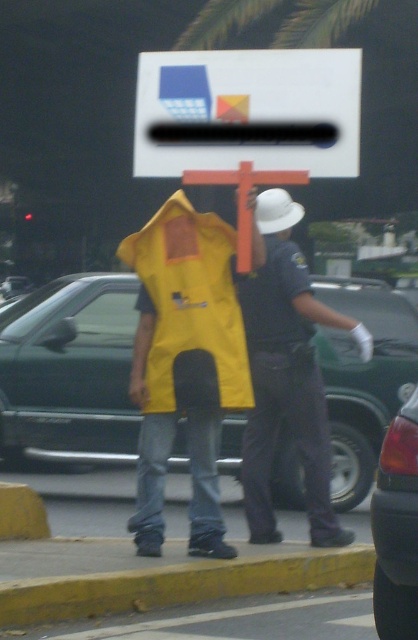
Question: Which point is closer to the camera taking this photo?

Choices:
 (A) pyautogui.click(x=76, y=582)
 (B) pyautogui.click(x=265, y=182)

Answer: (A)

Question: In this image, where is matte yellow vest at center located relative to orange painted wooden cross at center?

Choices:
 (A) right
 (B) left

Answer: (A)

Question: Among these points, which one is nearest to the camera?

Choices:
 (A) (262, 307)
 (B) (242, 132)
 (C) (377, 556)
 (D) (28, 563)

Answer: (C)

Question: Does yellow painted curb at lower center appear under yellow matte safety vest at center?

Choices:
 (A) yes
 (B) no

Answer: (A)

Question: Which of the following is the closest to the observer?

Choices:
 (A) coord(298,168)
 (B) coord(244,214)
 (C) coord(390,602)

Answer: (C)

Question: Can you confirm if matte plastic sign at center is positioned to the right of orange painted wooden cross at center?

Choices:
 (A) yes
 (B) no

Answer: (A)